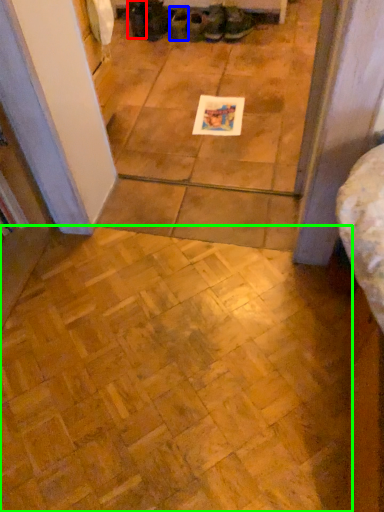
Question: Estimate the real-world distances between objects in this image. Which object is farther from footwear (highlighted by a red box), footwear (highlighted by a blue box) or ceramic tile (highlighted by a green box)?

Choices:
 (A) footwear
 (B) ceramic tile

Answer: (B)